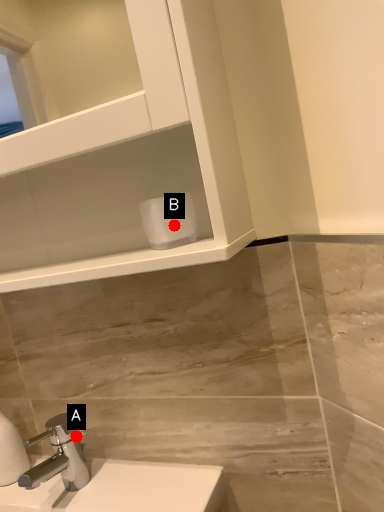
Question: Two points are circled on the image, labeled by A and B beside each circle. Which point is closer to the camera?

Choices:
 (A) A is closer
 (B) B is closer

Answer: (B)